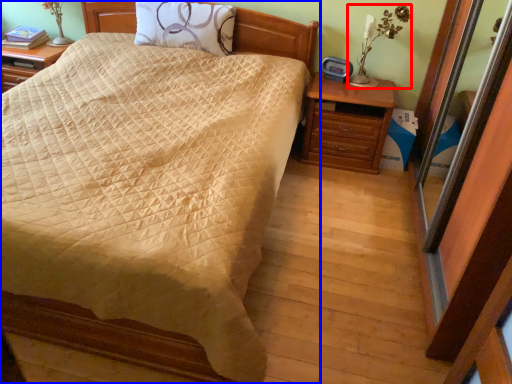
Question: Which object is closer to the camera taking this photo, table lamp (highlighted by a red box) or bed (highlighted by a blue box)?

Choices:
 (A) table lamp
 (B) bed

Answer: (B)